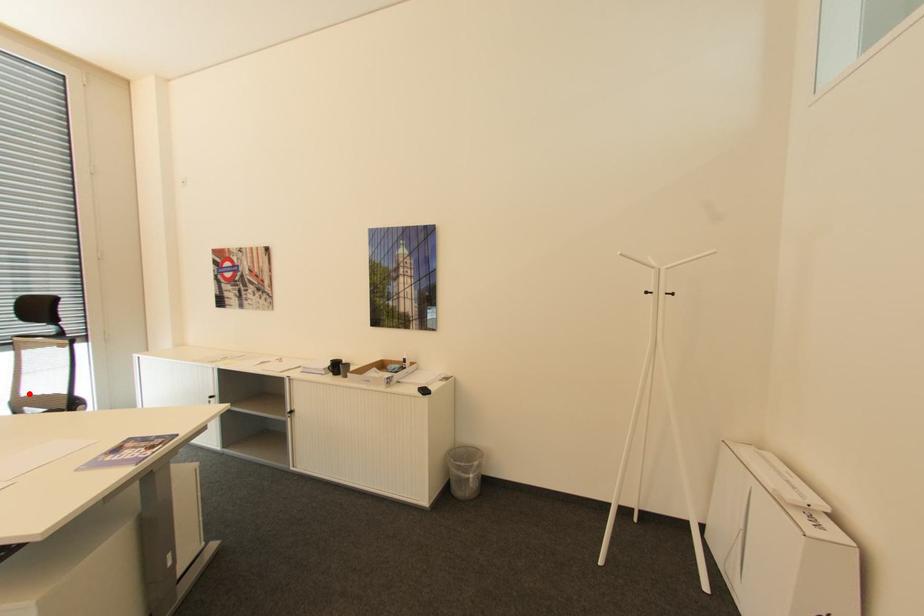
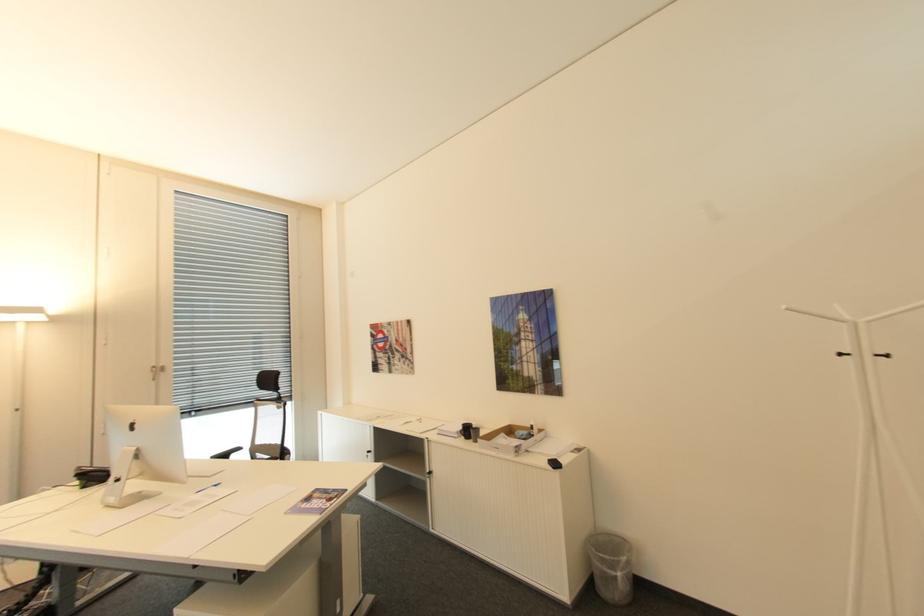
Locate, in the second image, the point that corresponds to the highlighted location in the first image.

(261, 442)